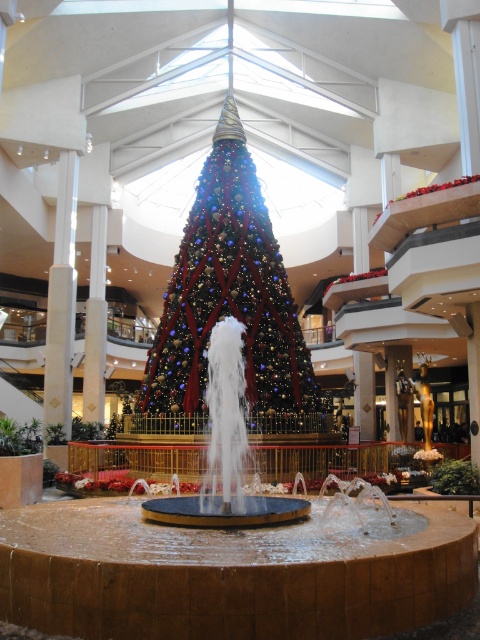
Measure the distance between multicolored glittering tree at center and shiny metallic fountain at center.

The distance of multicolored glittering tree at center from shiny metallic fountain at center is 7.98 meters.

Does multicolored glittering tree at center appear over shiny metallic fountain at center?

Yes, multicolored glittering tree at center is above shiny metallic fountain at center.

I want to click on multicolored glittering tree at center, so click(228, 304).